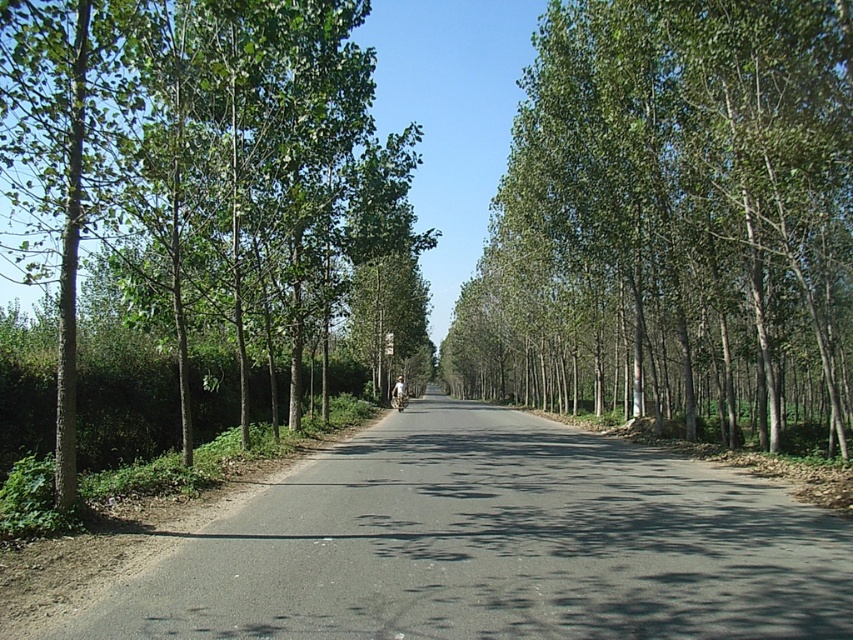
You are standing on the rural road and see the green leafy tree at center and the green leafy tree at left. Which tree is casting a shadow that falls directly on the road?

The green leafy tree at center is positioned under the green leafy tree at left, so the shadow of the green leafy tree at left falls directly on the road.